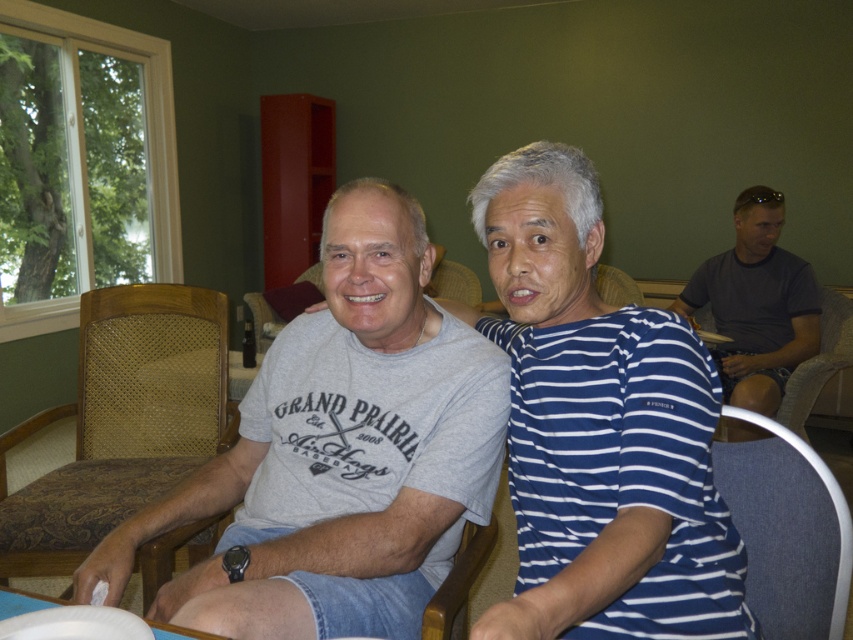
Who is positioned more to the left, gray cotton t-shirt at center or brown woven wood chair at left?

brown woven wood chair at left

Image resolution: width=853 pixels, height=640 pixels. I want to click on gray cotton t-shirt at center, so click(x=338, y=444).

Does gray cotton t-shirt at center come behind dark gray t-shirt at right?

That is False.

Between point (483, 385) and point (734, 300), which one is positioned behind?

The point (734, 300) is more distant.

Find the location of a particular element. Image resolution: width=853 pixels, height=640 pixels. gray cotton t-shirt at center is located at coordinates (338, 444).

Can you confirm if gray fabric chair at lower right is shorter than light brown fabric chair at right?

Indeed, gray fabric chair at lower right has a lesser height compared to light brown fabric chair at right.

Is point (851, 564) in front of point (805, 374)?

Yes, it is in front of point (805, 374).

Is point (741, 499) closer to viewer compared to point (802, 401)?

Yes.

Where is `gray fabric chair at lower right`? The height and width of the screenshot is (640, 853). gray fabric chair at lower right is located at coordinates (787, 529).